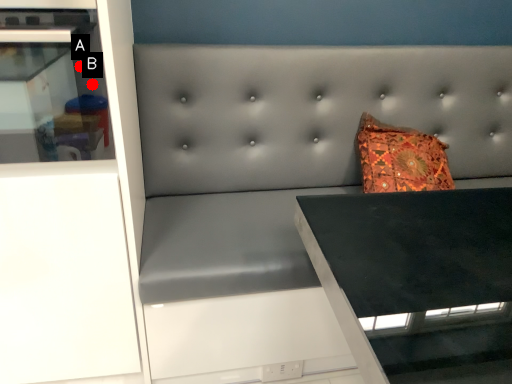
Question: Two points are circled on the image, labeled by A and B beside each circle. Which point is farther to the camera?

Choices:
 (A) A is further
 (B) B is further

Answer: (B)